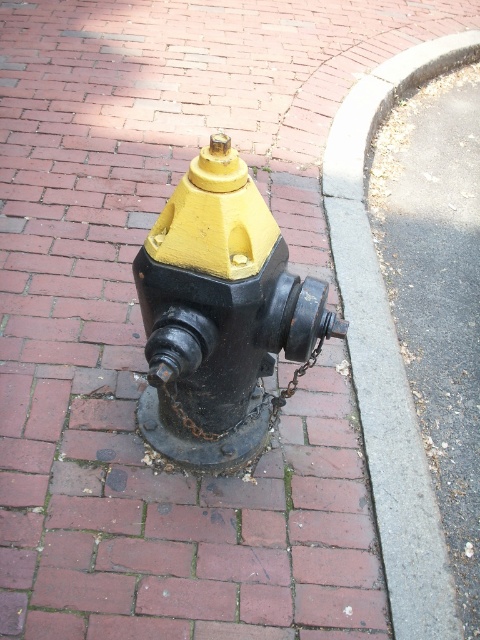
Question: Among these points, which one is nearest to the camera?

Choices:
 (A) (275, 417)
 (B) (186, 396)

Answer: (B)

Question: Considering the relative positions of matte black fire hydrant at center and gray concrete curb at lower right in the image provided, where is matte black fire hydrant at center located with respect to gray concrete curb at lower right?

Choices:
 (A) below
 (B) above

Answer: (A)

Question: Among these points, which one is nearest to the camera?

Choices:
 (A) (370, 337)
 (B) (252, 284)
 (C) (233, 428)

Answer: (B)

Question: Can you confirm if matte black fire hydrant at center is thinner than gray concrete curb at lower right?

Choices:
 (A) no
 (B) yes

Answer: (B)

Question: Is the position of matte black fire hydrant at center more distant than that of rusty metal chain at center?

Choices:
 (A) yes
 (B) no

Answer: (B)

Question: Which object is positioned farthest from the matte black fire hydrant at center?

Choices:
 (A) rusty metal chain at center
 (B) gray concrete curb at lower right

Answer: (B)